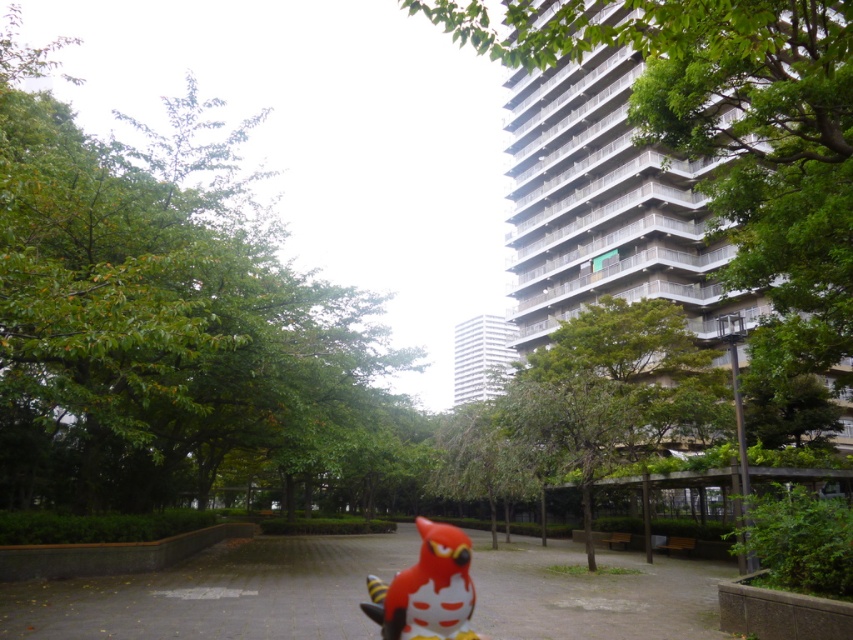
You are a child playing in the park and want to hide behind the green leafy tree at upper left. The matte red bird at center is nearby. Which object is wider so you can hide behind it?

The green leafy tree at upper left is wider than the matte red bird at center, so you can hide behind it.

You are a photographer standing in the urban park scene. You want to take a photo that includes both the green leafy tree at upper left and the matte red bird at center. Which object should you adjust your camera focus on first to ensure it appears sharp in the final image?

The green leafy tree at upper left is closer to the viewer than the matte red bird at center, so you should focus on the green leafy tree at upper left first to ensure both are in focus.